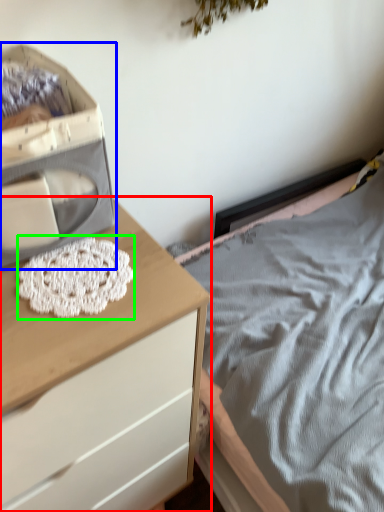
Question: Based on their relative distances, which object is farther from chest of drawers (highlighted by a red box)? Choose from storage box (highlighted by a blue box) and lace (highlighted by a green box).

Choices:
 (A) storage box
 (B) lace

Answer: (A)